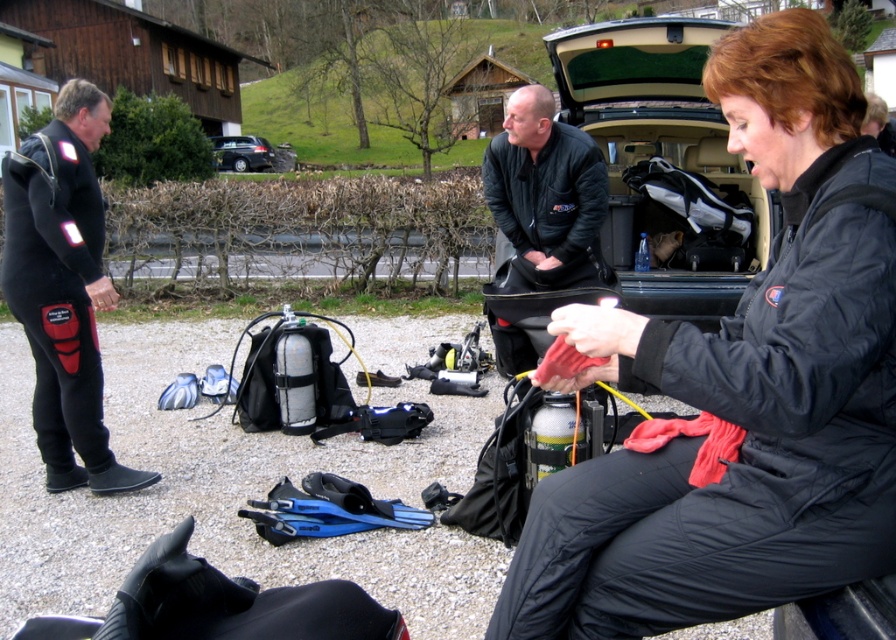
The height and width of the screenshot is (640, 896). Describe the element at coordinates (220, 605) in the screenshot. I see `black rubber glove at lower left` at that location.

Which is in front, point (149, 586) or point (599, 148)?

Positioned in front is point (149, 586).

Is point (184, 572) positioned before point (489, 150)?

Yes, it is in front of point (489, 150).

Locate an element on the screen. black rubber glove at lower left is located at coordinates [x=220, y=605].

Can you confirm if black rubber glove at lower left is taller than dark gray metallic car at center?

In fact, black rubber glove at lower left may be shorter than dark gray metallic car at center.

Which is more to the right, black rubber glove at lower left or dark gray metallic car at center?

black rubber glove at lower left

Which is in front, point (299, 627) or point (214, 154)?

Positioned in front is point (299, 627).

The width and height of the screenshot is (896, 640). Find the location of `black rubber glove at lower left`. black rubber glove at lower left is located at coordinates (220, 605).

Can you confirm if black matte wetsuit at left is positioned above black matte jacket at center?

Actually, black matte wetsuit at left is below black matte jacket at center.

Can you confirm if black matte wetsuit at left is shorter than black matte jacket at center?

Incorrect, black matte wetsuit at left's height does not fall short of black matte jacket at center's.

Does point (59, 264) come behind point (530, 202)?

No, (59, 264) is in front of (530, 202).

The width and height of the screenshot is (896, 640). I want to click on black matte wetsuit at left, so click(63, 288).